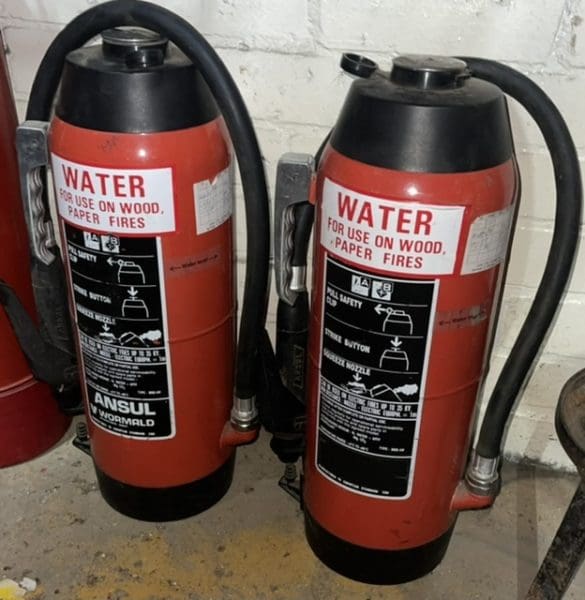
Locate an element on the screen. fire extinguisher cap is located at coordinates (433, 61), (123, 43).